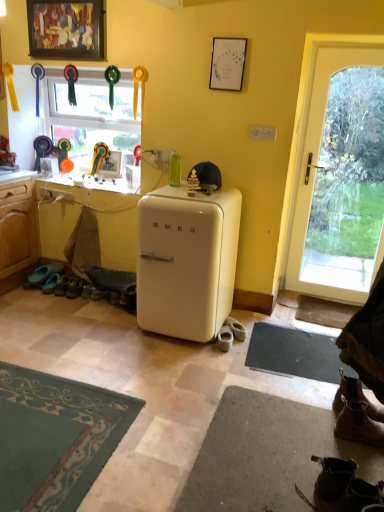
The width and height of the screenshot is (384, 512). I want to click on free point above white glass door at right (from a real-world perspective), so click(x=349, y=47).